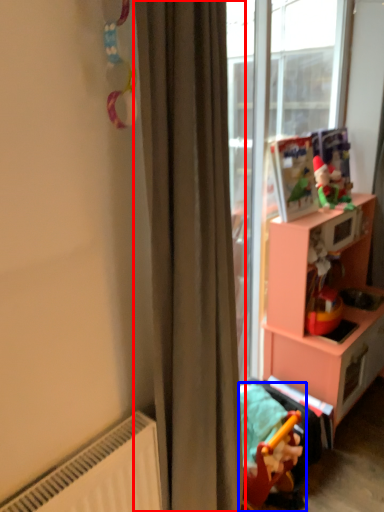
Question: Which point is further to the camera, curtain (highlighted by a red box) or toy (highlighted by a blue box)?

Choices:
 (A) curtain
 (B) toy

Answer: (B)